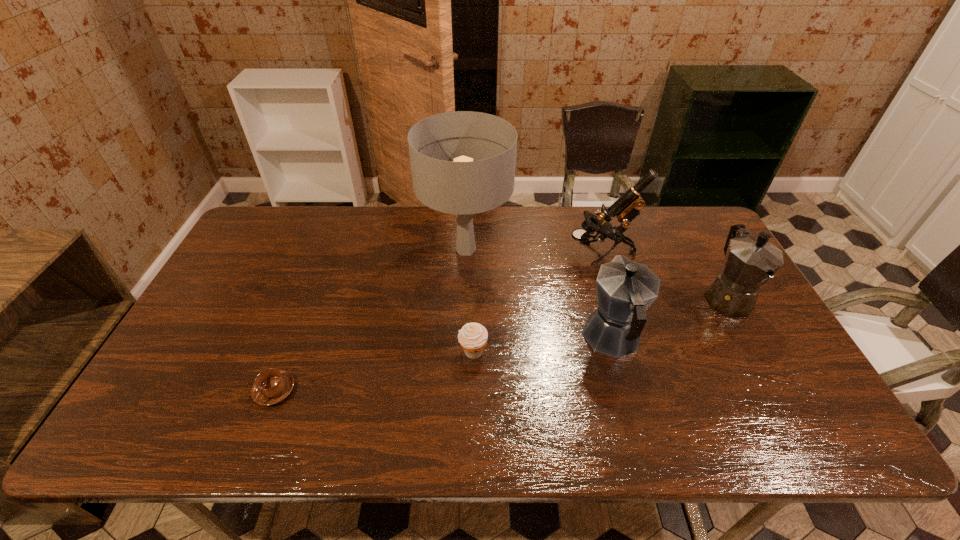
Locate an element on the screen. The image size is (960, 540). empty space that is in between the lampshade and the muffin is located at coordinates (469, 300).

You are a GUI agent. You are given a task and a screenshot of the screen. Output one action in this format:
    pyautogui.click(x=<x>, y=<y>)
    Task: Click on the empty location between the nearest object and the microscope
    
    Given the screenshot: What is the action you would take?
    pyautogui.click(x=438, y=322)

This screenshot has height=540, width=960. Identify the location of vacant region between the lampshade and the microscope. (534, 251).

Identify which object is the third closest to the right coffeepot. Please provide its 2D coordinates. Your answer should be formatted as a tuple, i.e. [(x, y)], where the tuple contains the x and y coordinates of a point satisfying the conditions above.

[(463, 187)]

The width and height of the screenshot is (960, 540). Find the location of `object that is the fourth closest one to the muffin`. object that is the fourth closest one to the muffin is located at coordinates (627, 207).

Image resolution: width=960 pixels, height=540 pixels. I want to click on free space that satisfies the following two spatial constraints: 1. on the back side of the fifth tallest object; 2. on the front-facing side of the lampshade, so click(474, 249).

Locate an element on the screen. blank area in the image that satisfies the following two spatial constraints: 1. at the spout of the left coffeepot; 2. on the front-facing side of the lampshade is located at coordinates (588, 249).

The image size is (960, 540). Find the location of `free space that satisfies the following two spatial constraints: 1. on the front-facing side of the tallest object; 2. on the side of the leftmost object with the handle`. free space that satisfies the following two spatial constraints: 1. on the front-facing side of the tallest object; 2. on the side of the leftmost object with the handle is located at coordinates (461, 390).

You are a GUI agent. You are given a task and a screenshot of the screen. Output one action in this format:
    pyautogui.click(x=<x>, y=<y>)
    Task: Click on the vacant space that satisfies the following two spatial constraints: 1. on the front-facing side of the tallest object; 2. at the spout of the left coffeepot
    
    Given the screenshot: What is the action you would take?
    pyautogui.click(x=463, y=338)

At what (x,y) coordinates should I click in order to perform the action: click on vacant space that satisfies the following two spatial constraints: 1. on the front-facing side of the tallest object; 2. on the right side of the muffin. Please return your answer as a coordinate pair (x, y). Looking at the image, I should click on (462, 352).